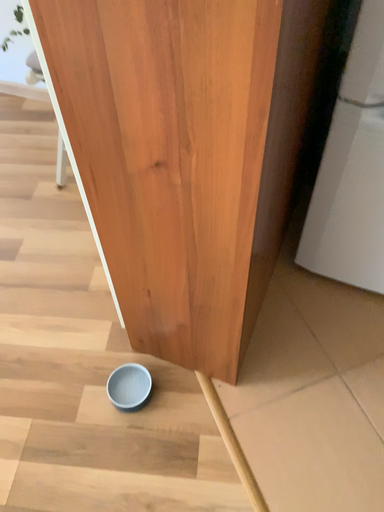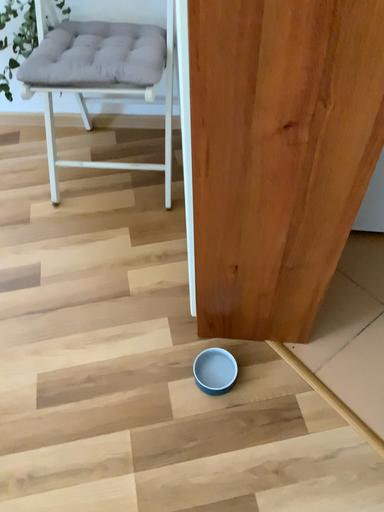
Question: How did the camera likely rotate when shooting the video?

Choices:
 (A) rotated right
 (B) rotated left

Answer: (A)